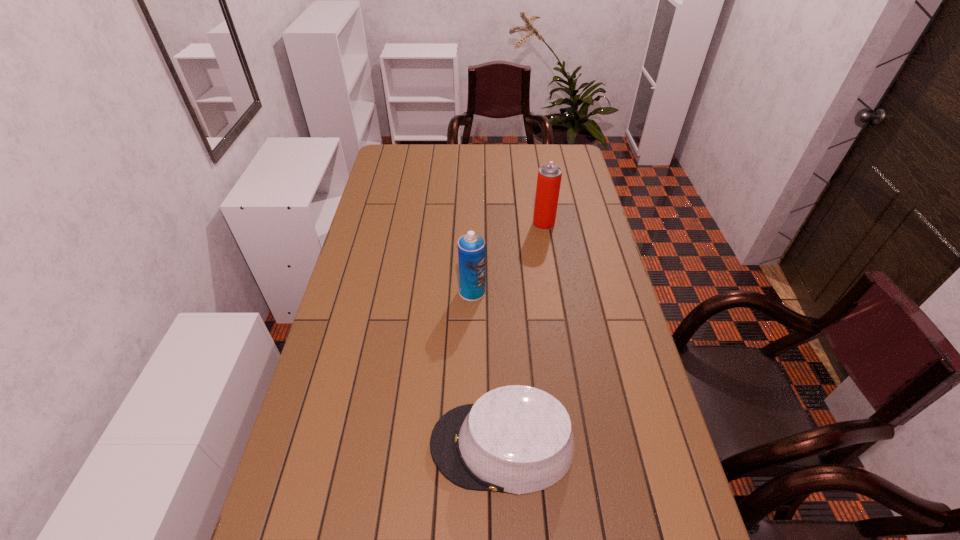
This screenshot has width=960, height=540. What are the coordinates of `the farther aerosol can` in the screenshot? It's located at (549, 177).

In order to click on the farthest object in this screenshot , I will do `click(549, 177)`.

At what (x,y) coordinates should I click in order to perform the action: click on the nearer aerosol can. Please return your answer as a coordinate pair (x, y). Looking at the image, I should click on (471, 247).

This screenshot has width=960, height=540. I want to click on the second farthest object, so click(471, 247).

The width and height of the screenshot is (960, 540). In order to click on the shortest object in this screenshot , I will do `click(516, 439)`.

I want to click on hat, so click(516, 439).

You are a GUI agent. You are given a task and a screenshot of the screen. Output one action in this format:
    pyautogui.click(x=<x>, y=<y>)
    Task: Click on the free space located 0.170m on the right of the right aerosol can
    
    Given the screenshot: What is the action you would take?
    pyautogui.click(x=599, y=224)

Find the location of `vacant area situated on the left of the left aerosol can`. vacant area situated on the left of the left aerosol can is located at coordinates (350, 292).

Locate an element on the screen. The width and height of the screenshot is (960, 540). vacant position located 0.140m on the front-facing side of the hat is located at coordinates (372, 445).

Locate an element on the screen. Image resolution: width=960 pixels, height=540 pixels. vacant space located 0.280m on the front-facing side of the hat is located at coordinates click(315, 445).